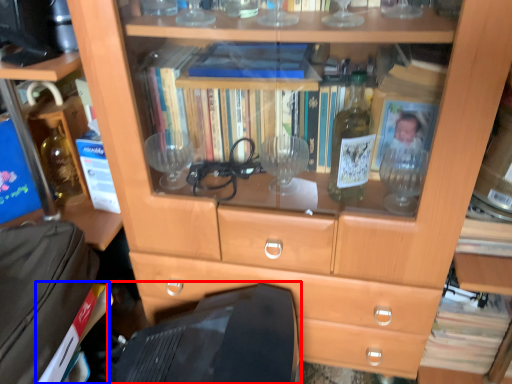
Question: Among these objects, which one is nearest to the camera, computer monitor (highlighted by a red box) or paperback book (highlighted by a blue box)?

Choices:
 (A) computer monitor
 (B) paperback book

Answer: (A)